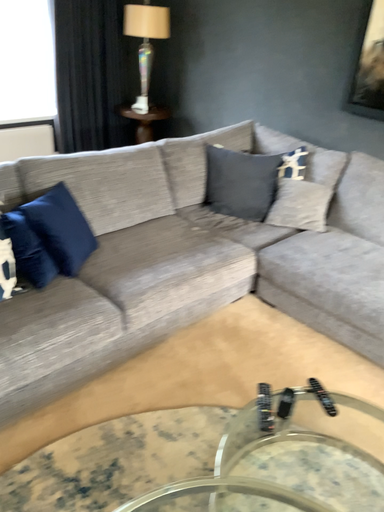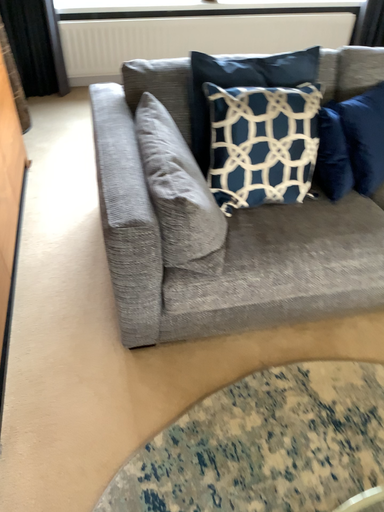
Question: How did the camera likely rotate when shooting the video?

Choices:
 (A) rotated left
 (B) rotated right

Answer: (A)